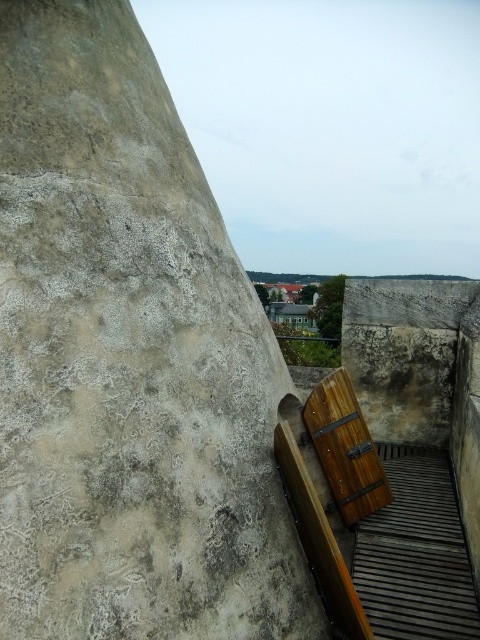
Is gray rough concrete at upper left to the left of wooden at right from the viewer's perspective?

Correct, you'll find gray rough concrete at upper left to the left of wooden at right.

You are a GUI agent. You are given a task and a screenshot of the screen. Output one action in this format:
    pyautogui.click(x=<x>, y=<y>)
    Task: Click on the gray rough concrete at upper left
    This screenshot has height=640, width=480.
    Given the screenshot: What is the action you would take?
    pyautogui.click(x=128, y=360)